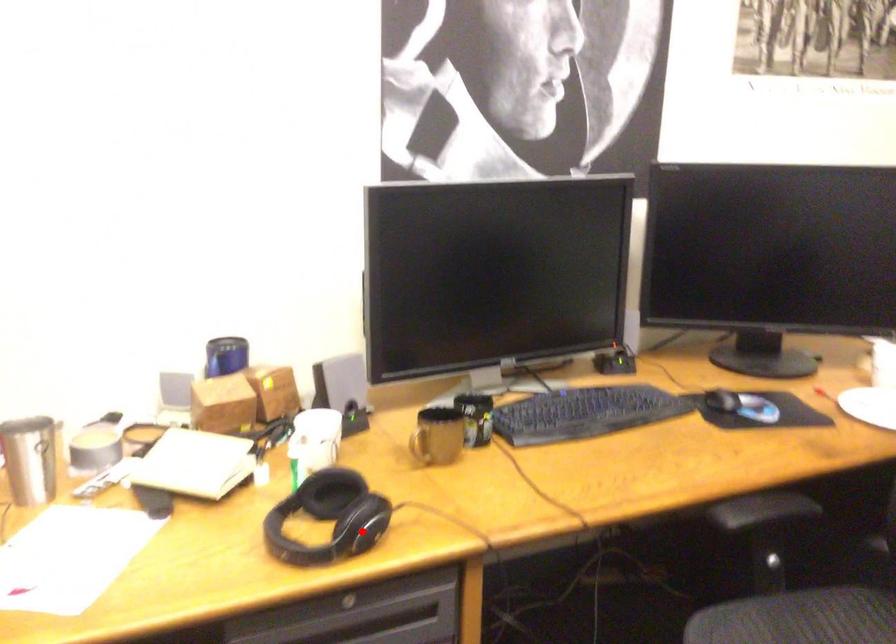
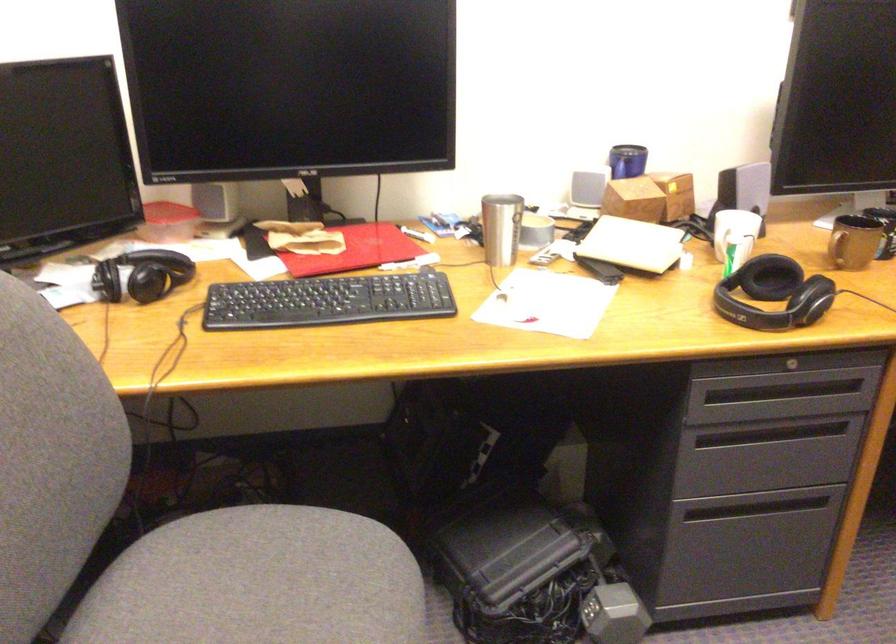
Question: A red point is marked in image1. In image2, is the corresponding 3D point closer to the camera or farther? Reply with the corresponding letter.

Choices:
 (A) The corresponding 3D point is closer.
 (B) The corresponding 3D point is farther.

Answer: (B)